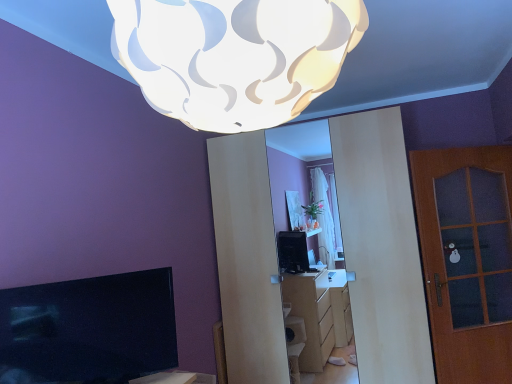
Question: Does brown wooden door at right have a larger size compared to white textured lampshade at upper center?

Choices:
 (A) no
 (B) yes

Answer: (A)

Question: From the image's perspective, is brown wooden door at right located above white textured lampshade at upper center?

Choices:
 (A) yes
 (B) no

Answer: (B)

Question: Considering the relative positions of brown wooden door at right and white textured lampshade at upper center in the image provided, is brown wooden door at right behind white textured lampshade at upper center?

Choices:
 (A) no
 (B) yes

Answer: (B)

Question: Is the position of brown wooden door at right less distant than that of white textured lampshade at upper center?

Choices:
 (A) yes
 (B) no

Answer: (B)

Question: From the image's perspective, does brown wooden door at right appear lower than white textured lampshade at upper center?

Choices:
 (A) yes
 (B) no

Answer: (A)

Question: From a real-world perspective, is brown wooden door at right physically located above or below matte black tv at lower left?

Choices:
 (A) above
 (B) below

Answer: (B)

Question: Is brown wooden door at right wider or thinner than matte black tv at lower left?

Choices:
 (A) wide
 (B) thin

Answer: (B)

Question: In the image, is brown wooden door at right on the left side or the right side of matte black tv at lower left?

Choices:
 (A) left
 (B) right

Answer: (B)

Question: From the image's perspective, is brown wooden door at right above or below matte black tv at lower left?

Choices:
 (A) below
 (B) above

Answer: (B)

Question: Looking at the image, does matte black tv at lower left seem bigger or smaller compared to brown wooden door at right?

Choices:
 (A) small
 (B) big

Answer: (A)

Question: Considering the positions of matte black tv at lower left and brown wooden door at right in the image, is matte black tv at lower left taller or shorter than brown wooden door at right?

Choices:
 (A) short
 (B) tall

Answer: (A)

Question: From the image's perspective, is matte black tv at lower left positioned above or below brown wooden door at right?

Choices:
 (A) above
 (B) below

Answer: (B)

Question: Visually, is matte black tv at lower left positioned to the left or to the right of brown wooden door at right?

Choices:
 (A) right
 (B) left

Answer: (B)

Question: From the image's perspective, is white textured lampshade at upper center above or below matte black tv at lower left?

Choices:
 (A) above
 (B) below

Answer: (A)

Question: Relative to matte black tv at lower left, is white textured lampshade at upper center in front or behind?

Choices:
 (A) behind
 (B) front

Answer: (B)